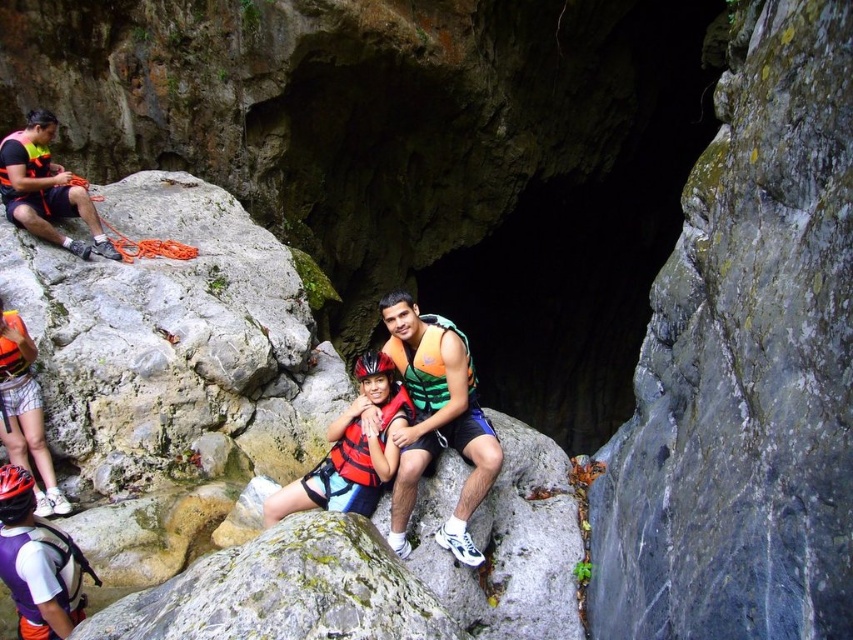
Between orange life vest at center and matte black rope at left, which one has less height?

With less height is matte black rope at left.

Can you confirm if orange life vest at center is positioned to the right of matte black rope at left?

Yes, orange life vest at center is to the right of matte black rope at left.

Is point (430, 324) positioned before point (79, 205)?

Yes.

The image size is (853, 640). I want to click on orange life vest at center, so click(x=437, y=420).